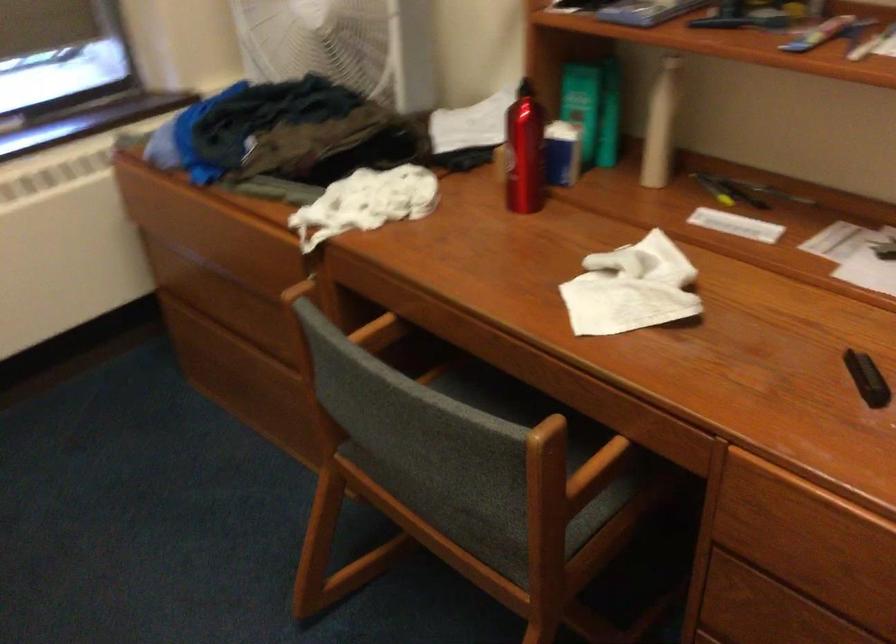
You are a GUI agent. You are given a task and a screenshot of the screen. Output one action in this format:
    pyautogui.click(x=<x>, y=<y>)
    Task: Click on the green plastic bottle
    This screenshot has width=896, height=644.
    Given the screenshot: What is the action you would take?
    pyautogui.click(x=582, y=104)